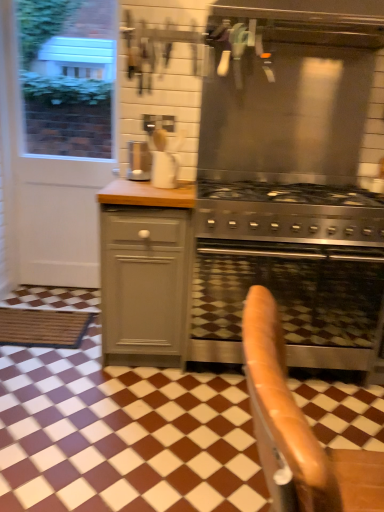
Question: From their relative heights in the image, would you say stainless steel oven at center is taller or shorter than white matte screen door at left?

Choices:
 (A) short
 (B) tall

Answer: (A)

Question: Based on their sizes in the image, would you say stainless steel oven at center is bigger or smaller than white matte screen door at left?

Choices:
 (A) small
 (B) big

Answer: (B)

Question: Estimate the real-world distances between objects in this image. Which object is closer to the matte gray cabinet at center-left?

Choices:
 (A) stainless steel vent at upper center
 (B) leather armchair at center
 (C) white matte screen door at left
 (D) white matte paper towel at center
 (E) satin silver coffee machine at center

Answer: (D)

Question: Estimate the real-world distances between objects in this image. Which object is closer to the satin silver coffee machine at center?

Choices:
 (A) stainless steel vent at upper center
 (B) white matte screen door at left
 (C) matte gray cabinet at center-left
 (D) leather armchair at center
 (E) stainless steel oven at center

Answer: (C)